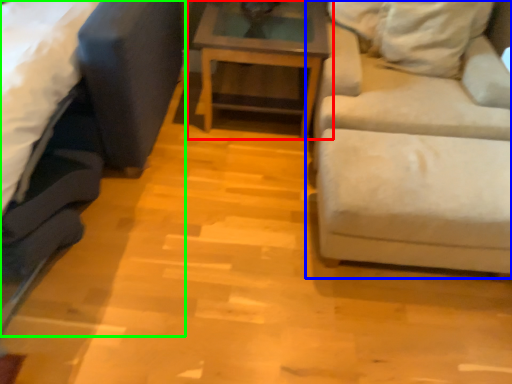
Question: Based on their relative distances, which object is nearer to table (highlighted by a red box)? Choose from studio couch (highlighted by a blue box) and studio couch (highlighted by a green box).

Choices:
 (A) studio couch
 (B) studio couch

Answer: (A)